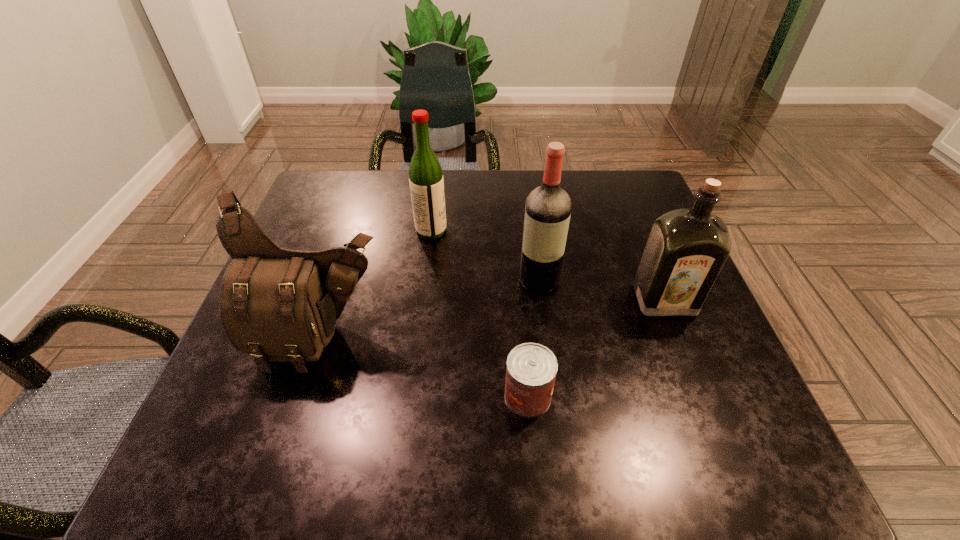
Locate an element on the screen. This screenshot has width=960, height=540. vacant space situated 0.100m on the label of the rightmost liquor is located at coordinates (686, 358).

Image resolution: width=960 pixels, height=540 pixels. Identify the location of vacant space located 0.190m on the left of the can. (399, 396).

The width and height of the screenshot is (960, 540). In order to click on object at the left edge in this screenshot , I will do click(279, 305).

Find the location of a particular element. Image resolution: width=960 pixels, height=540 pixels. object present at the right edge is located at coordinates (686, 248).

Identify the location of vacant space at the far edge of the desktop. The height and width of the screenshot is (540, 960). (590, 194).

Identify the location of vacant space at the near edge. point(520,471).

In the image, there is a desktop. At what (x,y) coordinates should I click in order to perform the action: click on vacant space at the left edge. Please return your answer as a coordinate pair (x, y). The image size is (960, 540). Looking at the image, I should click on (289, 420).

Where is `free region at the right edge of the desktop`? This screenshot has height=540, width=960. free region at the right edge of the desktop is located at coordinates (643, 233).

The image size is (960, 540). I want to click on vacant space at the far left corner of the desktop, so click(359, 207).

Locate an element on the screen. vacant space at the far right corner of the desktop is located at coordinates (632, 188).